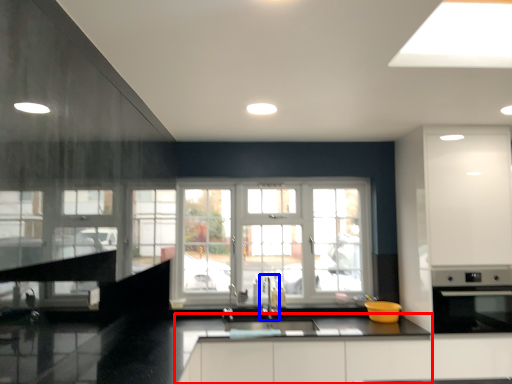
Question: Which point is closer to the camera, counter top (highlighted by a red box) or faucet (highlighted by a blue box)?

Choices:
 (A) counter top
 (B) faucet

Answer: (A)